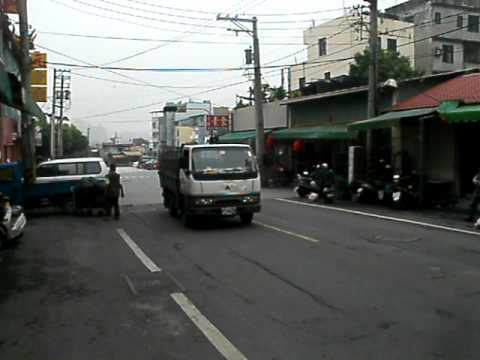
The height and width of the screenshot is (360, 480). I want to click on red display lantern, so click(x=299, y=145), click(x=269, y=141).